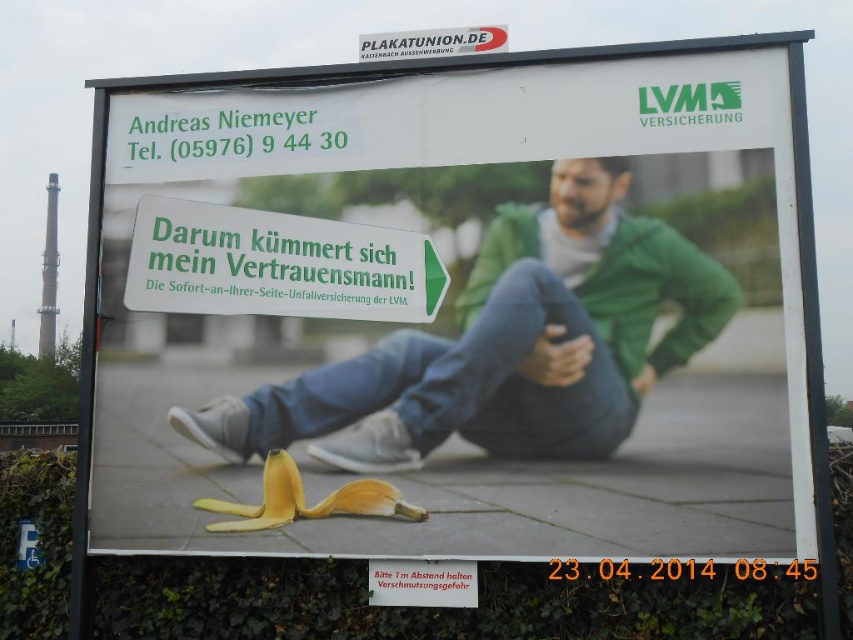
You are a photographer standing in front of the billboard. You notice two points marked on the billboard. The first point is at coordinates point [204,268] and the second point is at point [381,51]. Which point is closer to your camera?

Point [204,268] is closer to the camera than point [381,51].

You are a pedestrian walking past the billboard. You see the green matte jacket at center and the white plastic sign at upper center. Which object is positioned to the right side of the other?

The green matte jacket at center is to the right of the white plastic sign at upper center.

You are a pedestrian walking towards the billboard and notice the yellow peel at lower center and the green matte jacket at center. Which object is wider in the image?

The yellow peel at lower center might be wider than green matte jacket at center according to the image description.